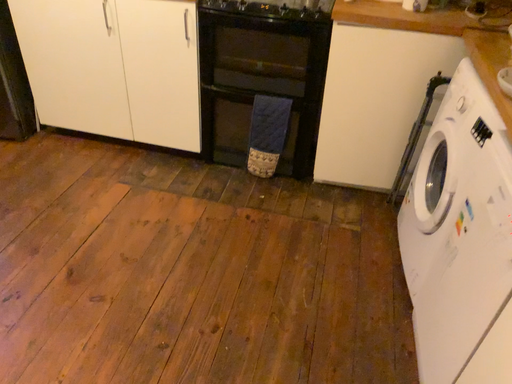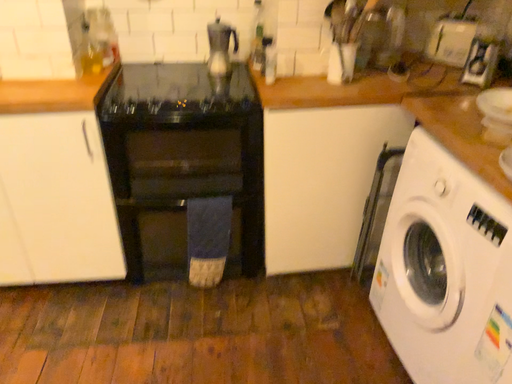
Question: How did the camera likely rotate when shooting the video?

Choices:
 (A) rotated right
 (B) rotated left

Answer: (A)